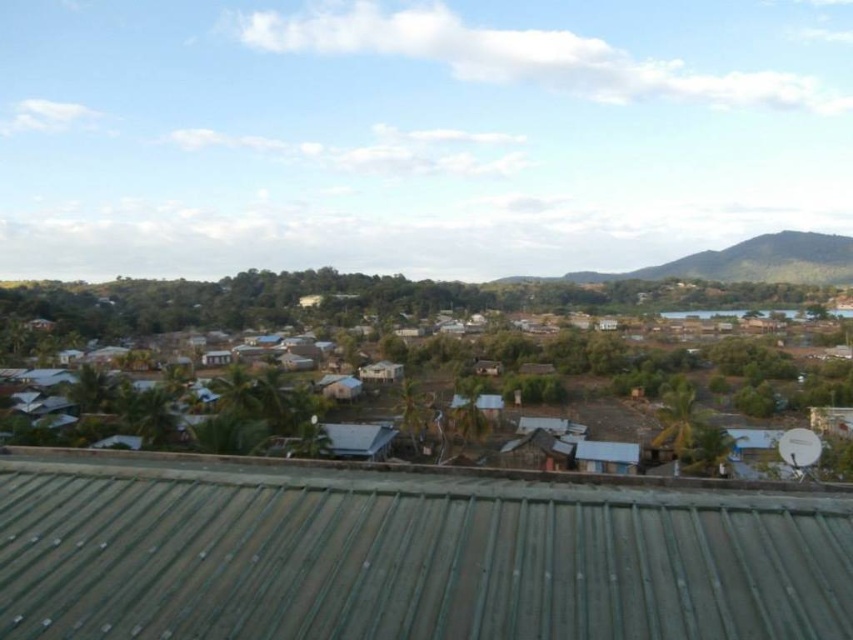
Based on the photo, you are standing on the corrugated metal roof in the foreground of the rural landscape image. You notice a point marked at coordinates (469, 346). What type of roofs are located at that point?

At point (469, 346) lies metallic roofs at center.

You are a drone operator tasked with capturing aerial footage of the village. Your drone is currently hovering above the metallic roofs at center. You need to fly it to the green textured hill at upper right. Given that the drone has a maximum flight range of 90 meters before needing to return, will it be able to reach the hill without needing to recharge?

The distance between the metallic roofs at center and the green textured hill at upper right is 88.24 meters. Since the drone can fly up to 90 meters, it will be able to reach the hill without needing to recharge.

You are standing on a rooftop in a rural village. You see a point marked at coordinates (405, 557). What does this point indicate?

The point at coordinates (405, 557) indicates the location of the green corrugated metal roof at center.